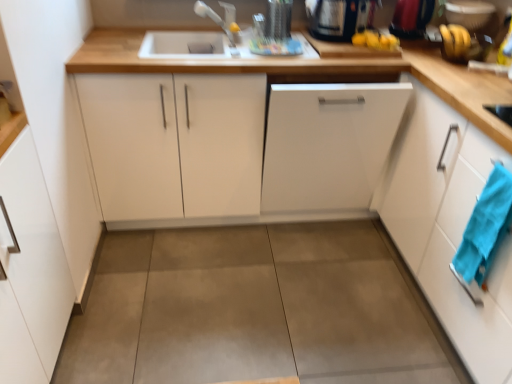
How much space does matte plastic bananas at upper right, positioned as the first appliance in right-to-left order, occupy horizontally?

10.17 inches.

Describe the element at coordinates (213, 19) in the screenshot. I see `matte silver faucet at upper center` at that location.

Locate an element on the screen. The width and height of the screenshot is (512, 384). white glossy cabinet at center, the third cabinetry positioned from the right is located at coordinates (234, 147).

Considering the sizes of white glossy cabinet at right, which is the 1th cabinetry from right to left, and concretesmoothfloor at center in the image, is white glossy cabinet at right, which is the 1th cabinetry from right to left, wider or thinner than concretesmoothfloor at center?

white glossy cabinet at right, which is the 1th cabinetry from right to left, is thinner than concretesmoothfloor at center.

Considering the positions of point (468, 172) and point (143, 302), is point (468, 172) closer or farther from the camera than point (143, 302)?

Point (468, 172) appears to be closer to the viewer than point (143, 302).

Considering the positions of objects white glossy cabinet at right, arranged as the fourth cabinetry when viewed from the left, and concretesmoothfloor at center in the image provided, who is in front, white glossy cabinet at right, arranged as the fourth cabinetry when viewed from the left, or concretesmoothfloor at center?

Positioned in front is white glossy cabinet at right, arranged as the fourth cabinetry when viewed from the left.

Is white glossy cabinet at center, which is the 2th cabinetry in left-to-right order, shorter than matte plastic bananas at upper right, the third appliance when ordered from left to right?

No.

From the image's perspective, who appears lower, white glossy cabinet at center, which is the 2th cabinetry in left-to-right order, or matte plastic bananas at upper right, the third appliance when ordered from left to right?

white glossy cabinet at center, which is the 2th cabinetry in left-to-right order, is shown below in the image.

In the image, is white glossy cabinet at center, which is the 2th cabinetry in left-to-right order, on the left side or the right side of matte plastic bananas at upper right, the third appliance when ordered from left to right?

white glossy cabinet at center, which is the 2th cabinetry in left-to-right order, is positioned on matte plastic bananas at upper right, the third appliance when ordered from left to right,'s left side.

Is white matte dishwasher at center, the third cabinetry viewed from the left, at the left side of white glossy cabinet at center, the third cabinetry positioned from the right?

No.

From the image's perspective, would you say white matte dishwasher at center, positioned as the 2th cabinetry in right-to-left order, is positioned over white glossy cabinet at center, which is the 2th cabinetry in left-to-right order?

No, from the image's perspective, white matte dishwasher at center, positioned as the 2th cabinetry in right-to-left order, is not above white glossy cabinet at center, which is the 2th cabinetry in left-to-right order.

Does white matte dishwasher at center, positioned as the 2th cabinetry in right-to-left order, turn towards white glossy cabinet at center, the third cabinetry positioned from the right?

Yes, white matte dishwasher at center, positioned as the 2th cabinetry in right-to-left order, is facing white glossy cabinet at center, the third cabinetry positioned from the right.

From a real-world perspective, relative to white glossy cabinet at center, which is the 2th cabinetry in left-to-right order, is white matte dishwasher at center, the third cabinetry viewed from the left, vertically above or below?

From a real-world perspective, white matte dishwasher at center, the third cabinetry viewed from the left, is physically below white glossy cabinet at center, which is the 2th cabinetry in left-to-right order.

Considering the positions of objects matte plastic bananas at upper right, the third appliance when ordered from left to right, and white glossy cabinet at lower left, positioned as the first cabinetry in left-to-right order, in the image provided, who is more to the right, matte plastic bananas at upper right, the third appliance when ordered from left to right, or white glossy cabinet at lower left, positioned as the first cabinetry in left-to-right order,?

From the viewer's perspective, matte plastic bananas at upper right, the third appliance when ordered from left to right, appears more on the right side.

Could you tell me if matte plastic bananas at upper right, the third appliance when ordered from left to right, is facing white glossy cabinet at lower left, positioned as the first cabinetry in left-to-right order?

No, matte plastic bananas at upper right, the third appliance when ordered from left to right, is not facing towards white glossy cabinet at lower left, positioned as the first cabinetry in left-to-right order.

Considering their positions, is matte plastic bananas at upper right, positioned as the first appliance in right-to-left order, located in front of or behind white glossy cabinet at lower left, positioned as the first cabinetry in left-to-right order?

Visually, matte plastic bananas at upper right, positioned as the first appliance in right-to-left order, is located behind white glossy cabinet at lower left, positioned as the first cabinetry in left-to-right order.

Which of these two, matte plastic bananas at upper right, positioned as the first appliance in right-to-left order, or white glossy cabinet at lower left, placed as the fourth cabinetry when sorted from right to left, is wider?

white glossy cabinet at lower left, placed as the fourth cabinetry when sorted from right to left, is wider.

Is matte plastic bananas at upper right, positioned as the first appliance in right-to-left order, inside or outside of white glossy cabinet at center, which is the 2th cabinetry in left-to-right order?

The correct answer is: outside.

Which is behind, matte plastic bananas at upper right, the third appliance when ordered from left to right, or white glossy cabinet at center, the third cabinetry positioned from the right?

Positioned behind is matte plastic bananas at upper right, the third appliance when ordered from left to right.

Considering the sizes of objects matte plastic bananas at upper right, positioned as the first appliance in right-to-left order, and white glossy cabinet at center, which is the 2th cabinetry in left-to-right order, in the image provided, who is wider, matte plastic bananas at upper right, positioned as the first appliance in right-to-left order, or white glossy cabinet at center, which is the 2th cabinetry in left-to-right order,?

white glossy cabinet at center, which is the 2th cabinetry in left-to-right order.

Could you tell me if matte plastic bananas at upper right, positioned as the first appliance in right-to-left order, is turned towards white glossy cabinet at center, which is the 2th cabinetry in left-to-right order?

No, matte plastic bananas at upper right, positioned as the first appliance in right-to-left order, does not turn towards white glossy cabinet at center, which is the 2th cabinetry in left-to-right order.

Relative to white glossy cabinet at right, arranged as the fourth cabinetry when viewed from the left, is blue fabric hand towel at right in front or behind?

Clearly, blue fabric hand towel at right is behind white glossy cabinet at right, arranged as the fourth cabinetry when viewed from the left.

Is blue fabric hand towel at right wider than white glossy cabinet at right, arranged as the fourth cabinetry when viewed from the left?

No, blue fabric hand towel at right is not wider than white glossy cabinet at right, arranged as the fourth cabinetry when viewed from the left.

From the picture: From the image's perspective, which is below, blue fabric hand towel at right or white glossy cabinet at right, arranged as the fourth cabinetry when viewed from the left?

blue fabric hand towel at right, from the image's perspective.

Who is taller, blue fabric hand towel at right or white glossy cabinet at right, which is the 1th cabinetry from right to left?

white glossy cabinet at right, which is the 1th cabinetry from right to left.

How different are the orientations of black glossy kettle at upper right, which appears as the 3th appliance when viewed from the right, and metallic silver kettle at upper right, arranged as the second appliance when viewed from the right, in degrees?

The facing directions of black glossy kettle at upper right, which appears as the 3th appliance when viewed from the right, and metallic silver kettle at upper right, arranged as the second appliance when viewed from the right, are 0.846 degrees apart.

Are black glossy kettle at upper right, which appears as the 3th appliance when viewed from the right, and metallic silver kettle at upper right, the 2th appliance positioned from the left, far apart?

No, black glossy kettle at upper right, which appears as the 3th appliance when viewed from the right, is not far away from metallic silver kettle at upper right, the 2th appliance positioned from the left.

Considering the relative sizes of black glossy kettle at upper right, which ranks as the 1th appliance in left-to-right order, and metallic silver kettle at upper right, arranged as the second appliance when viewed from the right, in the image provided, is black glossy kettle at upper right, which ranks as the 1th appliance in left-to-right order, thinner than metallic silver kettle at upper right, arranged as the second appliance when viewed from the right,?

No.

Considering the positions of objects black glossy kettle at upper right, which ranks as the 1th appliance in left-to-right order, and metallic silver kettle at upper right, the 2th appliance positioned from the left, in the image provided, who is more to the right, black glossy kettle at upper right, which ranks as the 1th appliance in left-to-right order, or metallic silver kettle at upper right, the 2th appliance positioned from the left,?

metallic silver kettle at upper right, the 2th appliance positioned from the left, is more to the right.

The image size is (512, 384). I want to click on concrete below the white glossy cabinet at right, arranged as the fourth cabinetry when viewed from the left (from the image's perspective), so click(255, 309).

Locate an element on the screen. This screenshot has width=512, height=384. the 3rd appliance above the white glossy cabinet at center, the third cabinetry positioned from the right (from the image's perspective) is located at coordinates (468, 13).

Estimate the real-world distances between objects in this image. Which object is closer to blue fabric hand towel at right, matte silver faucet at upper center or white matte dishwasher at center, positioned as the 2th cabinetry in right-to-left order?

Among the two, white matte dishwasher at center, positioned as the 2th cabinetry in right-to-left order, is located nearer to blue fabric hand towel at right.

Looking at this image, estimate the real-world distances between objects in this image. Which object is further from white glossy cabinet at lower left, positioned as the first cabinetry in left-to-right order, matte plastic bananas at upper right, the third appliance when ordered from left to right, or white glossy cabinet at center, the third cabinetry positioned from the right?

matte plastic bananas at upper right, the third appliance when ordered from left to right, lies further to white glossy cabinet at lower left, positioned as the first cabinetry in left-to-right order, than the other object.

Considering their positions, is matte plastic bananas at upper right, the third appliance when ordered from left to right, positioned further to concretesmoothfloor at center than white glossy cabinet at lower left, positioned as the first cabinetry in left-to-right order?

The object further to concretesmoothfloor at center is matte plastic bananas at upper right, the third appliance when ordered from left to right.

Considering their positions, is metallic silver kettle at upper right, the 2th appliance positioned from the left, positioned further to matte silver faucet at upper center than white glossy cabinet at right, arranged as the fourth cabinetry when viewed from the left?

Among the two, white glossy cabinet at right, arranged as the fourth cabinetry when viewed from the left, is located further to matte silver faucet at upper center.

From the image, which object appears to be farther from matte silver faucet at upper center, blue fabric hand towel at right or concretesmoothfloor at center?

blue fabric hand towel at right lies further to matte silver faucet at upper center than the other object.

Estimate the real-world distances between objects in this image. Which object is further from white glossy cabinet at right, which is the 1th cabinetry from right to left, white matte dishwasher at center, the third cabinetry viewed from the left, or matte plastic bananas at upper right, positioned as the first appliance in right-to-left order?

matte plastic bananas at upper right, positioned as the first appliance in right-to-left order, is further to white glossy cabinet at right, which is the 1th cabinetry from right to left.

From the image, which object appears to be farther from black glossy kettle at upper right, which ranks as the 1th appliance in left-to-right order, metallic silver kettle at upper right, arranged as the second appliance when viewed from the right, or matte plastic bananas at upper right, positioned as the first appliance in right-to-left order?

The object further to black glossy kettle at upper right, which ranks as the 1th appliance in left-to-right order, is matte plastic bananas at upper right, positioned as the first appliance in right-to-left order.

Which object lies nearer to the anchor point white glossy cabinet at right, which is the 1th cabinetry from right to left, blue fabric hand towel at right or matte plastic bananas at upper right, positioned as the first appliance in right-to-left order?

blue fabric hand towel at right.

Image resolution: width=512 pixels, height=384 pixels. In order to click on hand towel situated between white glossy cabinet at center, which is the 2th cabinetry in left-to-right order, and matte plastic bananas at upper right, the third appliance when ordered from left to right, from left to right in this screenshot , I will do `click(485, 228)`.

I want to click on appliance between black glossy kettle at upper right, which ranks as the 1th appliance in left-to-right order, and blue fabric hand towel at right vertically, so click(x=411, y=18).

Locate an element on the screen. appliance located between matte silver faucet at upper center and metallic silver kettle at upper right, the 2th appliance positioned from the left, in the left-right direction is located at coordinates (337, 18).

Identify the location of faucet between white glossy cabinet at lower left, positioned as the first cabinetry in left-to-right order, and metallic silver kettle at upper right, arranged as the second appliance when viewed from the right. (213, 19).